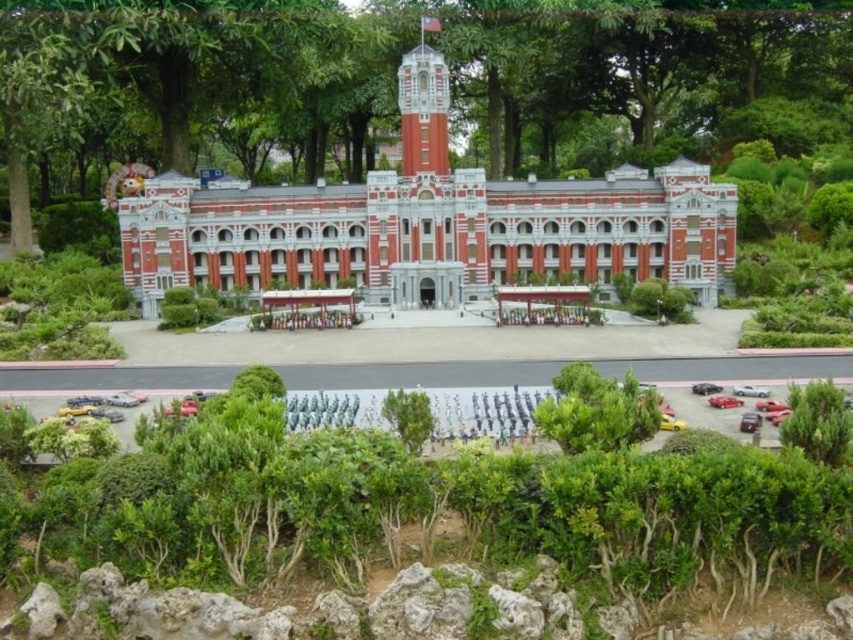
Question: Which point is farther to the camera?

Choices:
 (A) red brick building at center
 (B) red brick clock tower at upper center

Answer: (A)

Question: Is red brick building at center behind red brick clock tower at upper center?

Choices:
 (A) no
 (B) yes

Answer: (B)

Question: Which of the following is the closest to the observer?

Choices:
 (A) (405, 112)
 (B) (660, 268)

Answer: (A)

Question: Observing the image, what is the correct spatial positioning of red brick building at center in reference to red brick clock tower at upper center?

Choices:
 (A) left
 (B) right

Answer: (A)

Question: Can you confirm if red brick building at center is bigger than red brick clock tower at upper center?

Choices:
 (A) no
 (B) yes

Answer: (B)

Question: Which point is farther to the camera?

Choices:
 (A) (424, 160)
 (B) (219, 262)

Answer: (B)